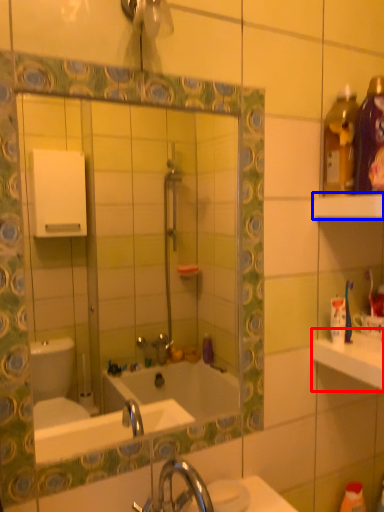
Question: Which of the following is the closest to the observer, counter top (highlighted by a red box) or shelf (highlighted by a blue box)?

Choices:
 (A) counter top
 (B) shelf

Answer: (B)